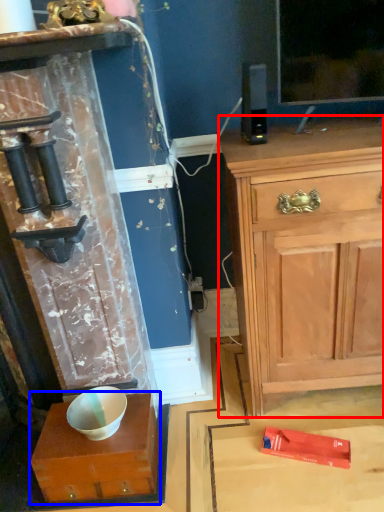
Question: Which object appears farthest to the camera in this image, chest of drawers (highlighted by a red box) or cabinetry (highlighted by a blue box)?

Choices:
 (A) chest of drawers
 (B) cabinetry

Answer: (B)